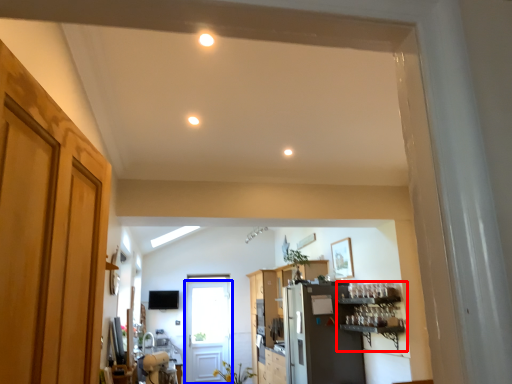
Question: Which object appears closest to the camera in this image, shelf (highlighted by a red box) or door (highlighted by a blue box)?

Choices:
 (A) shelf
 (B) door

Answer: (A)